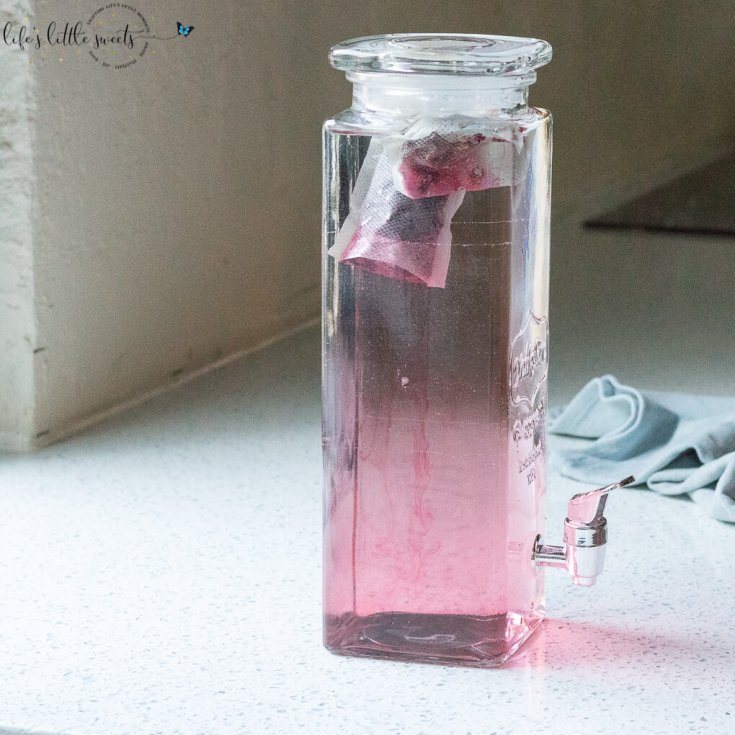
Where is `blue towel`? The image size is (735, 735). blue towel is located at coordinates (656, 448).